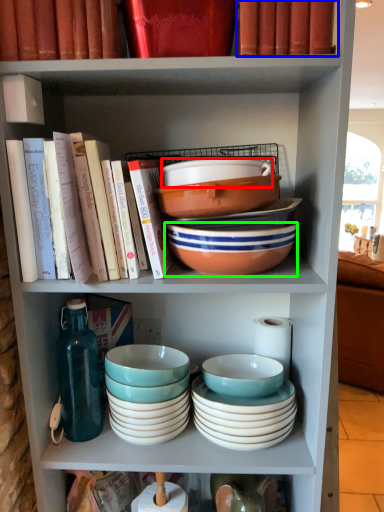
Question: Which is farther away from bowl (highlighted by a red box)? book (highlighted by a blue box) or bowl (highlighted by a green box)?

Choices:
 (A) book
 (B) bowl

Answer: (A)